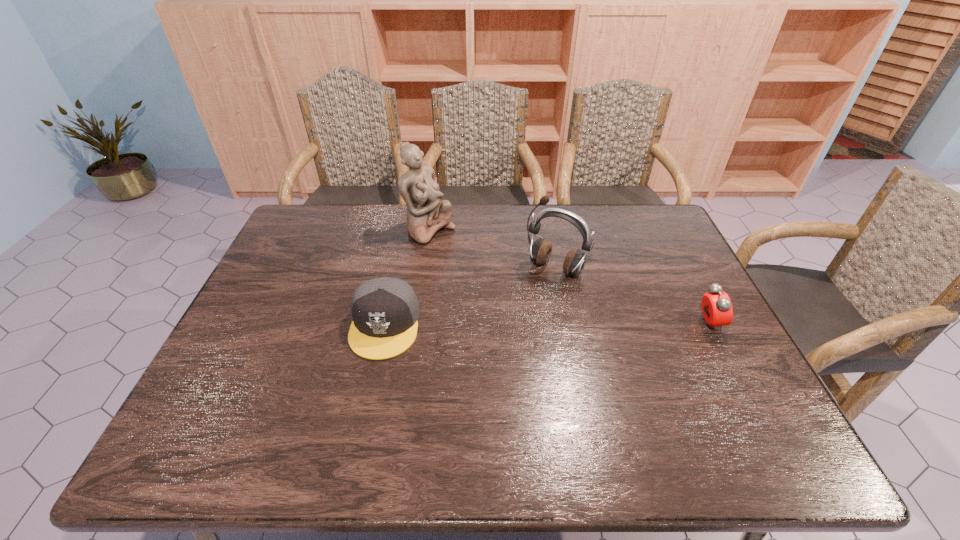
Where is `free space on the desktop that is between the cap and the alarm clock and is positioned on the ear pads of the third nearest object`? free space on the desktop that is between the cap and the alarm clock and is positioned on the ear pads of the third nearest object is located at coordinates (516, 325).

This screenshot has width=960, height=540. What are the coordinates of `vacant spot on the desktop that is between the cap and the rightmost object and is positioned on the front-facing side of the farthest object` in the screenshot? It's located at (567, 325).